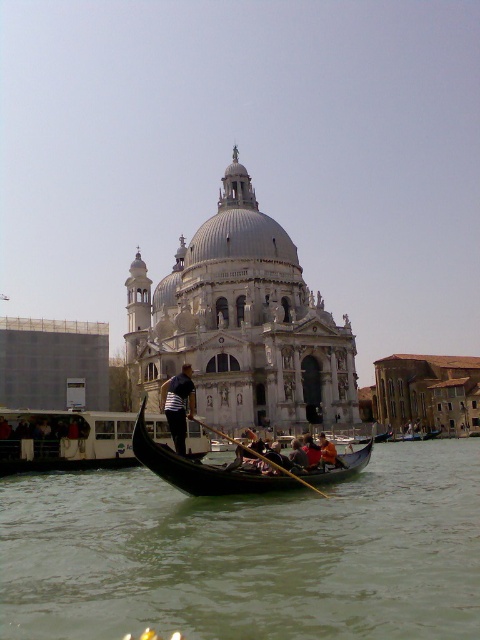
Question: Does greenish water at gondola center appear over black polished wood gondola at center?

Choices:
 (A) yes
 (B) no

Answer: (B)

Question: Which object is positioned farthest from the striped shirt at center?

Choices:
 (A) black polished wood gondola at center
 (B) wooden gondola at center
 (C) orange fabric person at center

Answer: (B)

Question: Which of these objects is positioned farthest from the orange fabric person at center?

Choices:
 (A) white marble cathedral at center
 (B) black polished wood gondola at center
 (C) greenish water at gondola center
 (D) striped shirt at center

Answer: (A)

Question: Is greenish water at gondola center wider than white marble cathedral at center?

Choices:
 (A) no
 (B) yes

Answer: (B)

Question: Can you confirm if black polished wood gondola at center is positioned below striped shirt at center?

Choices:
 (A) no
 (B) yes

Answer: (B)

Question: Which of the following is the farthest from the observer?

Choices:
 (A) (301, 480)
 (B) (31, 637)
 (C) (422, 436)

Answer: (C)